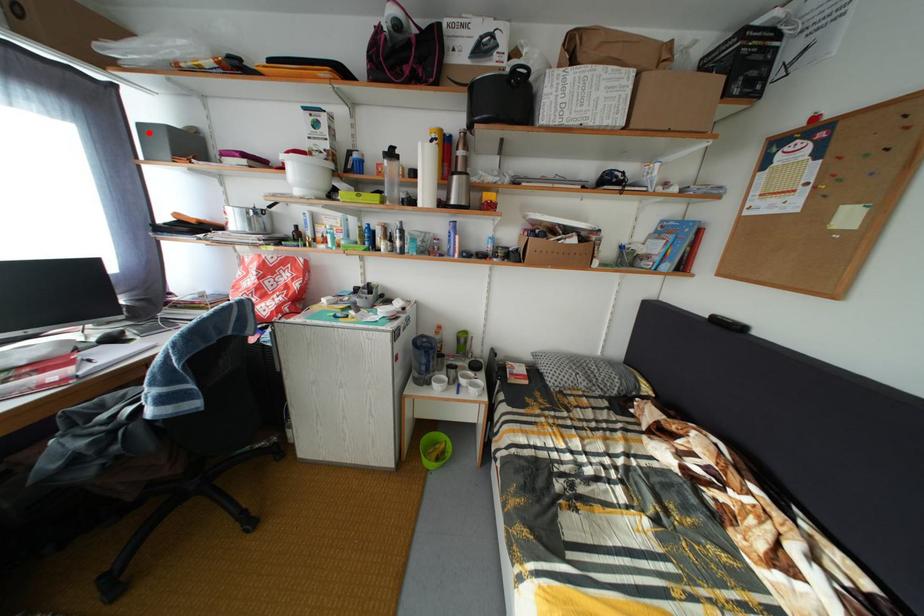
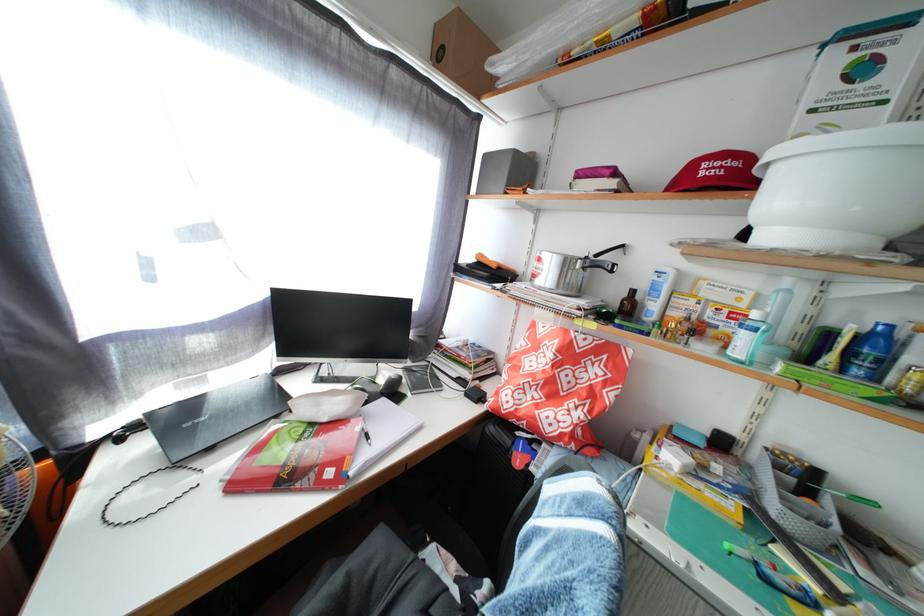
Where in the second image is the point corresponding to the highlighted location from the first image?

(494, 163)